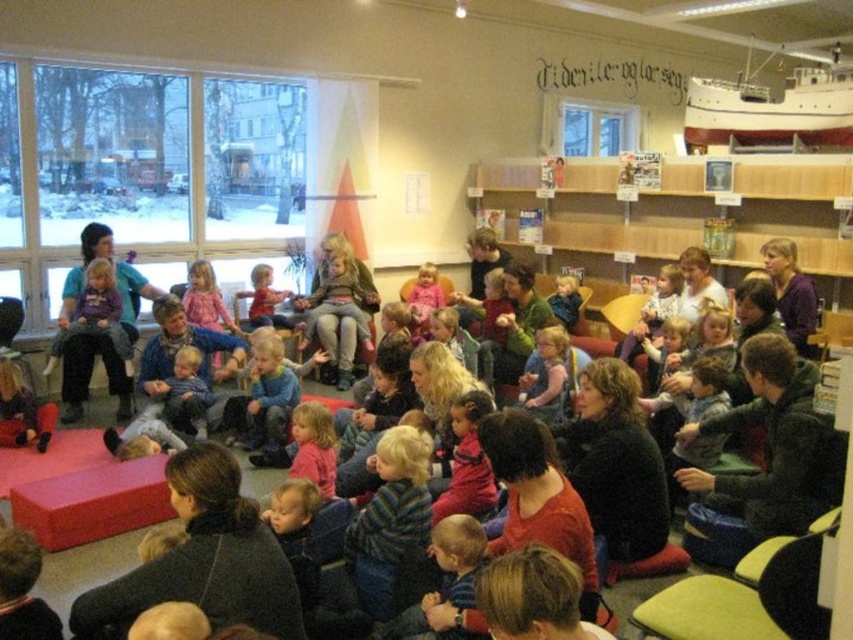
You are organizing a photo shoot and need to arrange two sweaters on a table. The dark green sweater at lower right and the matte pink sweater at center are available. If the table can only accommodate one sweater, which one has a better chance of fitting based on their widths?

The dark green sweater at lower right might be wider than the matte pink sweater at center, so the matte pink sweater at center has a better chance of fitting on the table if space is limited.

You are a photographer setting up a tripod to capture a group photo of the participants in the room. You notice the matte pink sweater at center and the blue denim pants at center. Which clothing item should you adjust your camera angle to focus on first to ensure both are in frame?

The matte pink sweater at center is much taller than the blue denim pants at center, so you should focus on the matte pink sweater at center first to ensure the camera angle accommodates its height before adjusting for the shorter blue denim pants at center.

You are standing at the entrance of the room and want to locate the dark green sweater at lower right. According to the coordinates provided, where exactly is the dark green sweater located in the room?

The dark green sweater at lower right is located at coordinates point (775, 445) in the room.